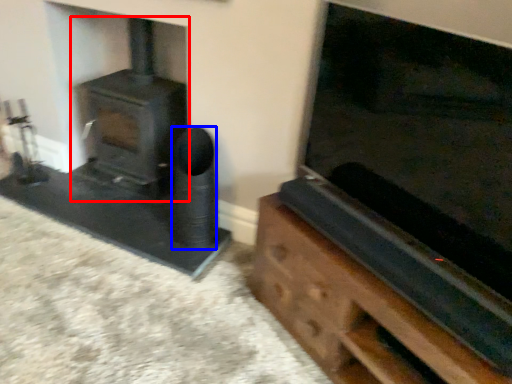
Question: Among these objects, which one is nearest to the camera, wood burning stove (highlighted by a red box) or speaker (highlighted by a blue box)?

Choices:
 (A) wood burning stove
 (B) speaker

Answer: (B)